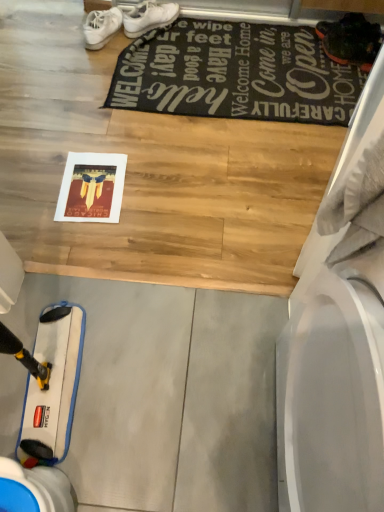
In order to click on vacant space that is to the left of white matte sneakers at upper center in this screenshot , I will do `click(43, 39)`.